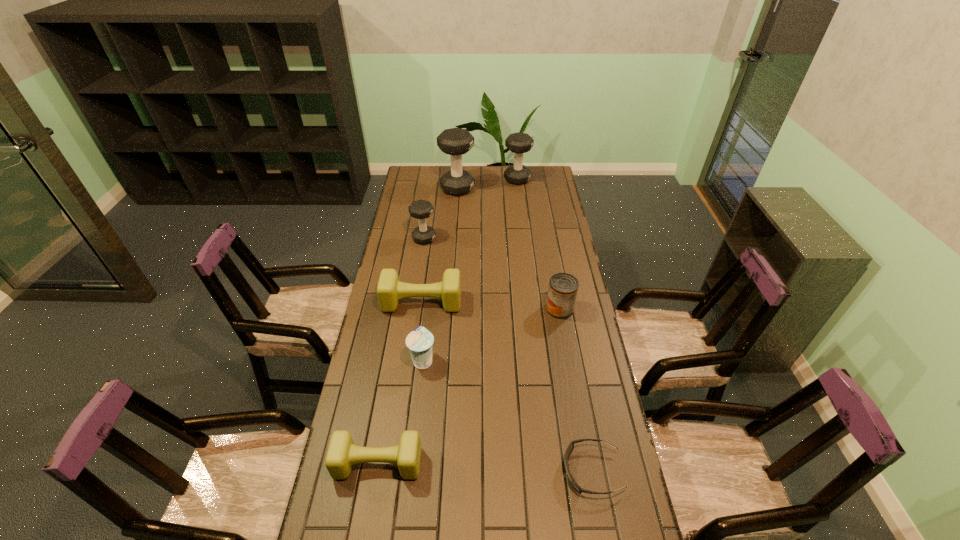
This screenshot has height=540, width=960. In the image, there is a desktop. Identify the location of vacant area at the far edge. (440, 186).

The width and height of the screenshot is (960, 540). In the image, there is a desktop. In order to click on vacant space at the left edge in this screenshot , I will do `click(393, 362)`.

Locate an element on the screen. The width and height of the screenshot is (960, 540). vacant region at the right edge of the desktop is located at coordinates (557, 209).

Image resolution: width=960 pixels, height=540 pixels. I want to click on vacant region at the far left corner of the desktop, so click(x=424, y=177).

The image size is (960, 540). What are the coordinates of `empty space between the bigger olive dumbbell and the smaller olive dumbbell` in the screenshot? It's located at [400, 383].

Where is `vacant area between the third farthest object and the rightmost dumbbell`? vacant area between the third farthest object and the rightmost dumbbell is located at coordinates (470, 209).

I want to click on vacant space that is in between the tallest object and the smaller olive dumbbell, so click(x=418, y=326).

Identify the location of free spot between the can and the third farthest dumbbell. The width and height of the screenshot is (960, 540). (492, 274).

At what (x,y) coordinates should I click in order to perform the action: click on free space between the rightmost dumbbell and the third tallest object. Please return your answer as a coordinate pair (x, y). This screenshot has width=960, height=540. Looking at the image, I should click on (470, 209).

Find the location of a particular element. Image resolution: width=960 pixels, height=540 pixels. vacant space in between the farther olive dumbbell and the smaller olive dumbbell is located at coordinates (400, 383).